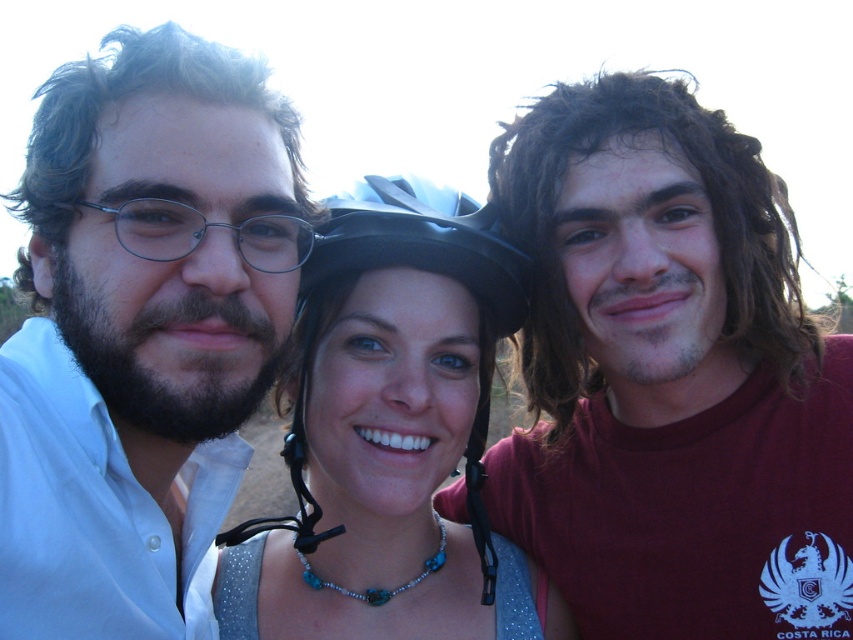
Can you confirm if matte white shirt at left is positioned to the right of matte black helmet at center?

In fact, matte white shirt at left is to the left of matte black helmet at center.

I want to click on matte white shirt at left, so click(x=140, y=328).

The width and height of the screenshot is (853, 640). Describe the element at coordinates (140, 328) in the screenshot. I see `matte white shirt at left` at that location.

This screenshot has height=640, width=853. Find the location of `matte white shirt at left`. matte white shirt at left is located at coordinates (140, 328).

Is matte black helmet at upper center positioned in front of black matte helmet at center?

No, it is behind black matte helmet at center.

Can you confirm if matte black helmet at upper center is taller than black matte helmet at center?

Yes, matte black helmet at upper center is taller than black matte helmet at center.

Does point (778, 573) come behind point (453, 262)?

No, it is not.

The height and width of the screenshot is (640, 853). I want to click on matte black helmet at upper center, so click(669, 378).

Does matte white shirt at left have a larger size compared to matte black glasses at left?

Yes.

Who is higher up, matte white shirt at left or matte black glasses at left?

matte black glasses at left is higher up.

Which is behind, point (167, 129) or point (282, 218)?

Point (282, 218)

Find the location of a particular element. matte white shirt at left is located at coordinates (140, 328).